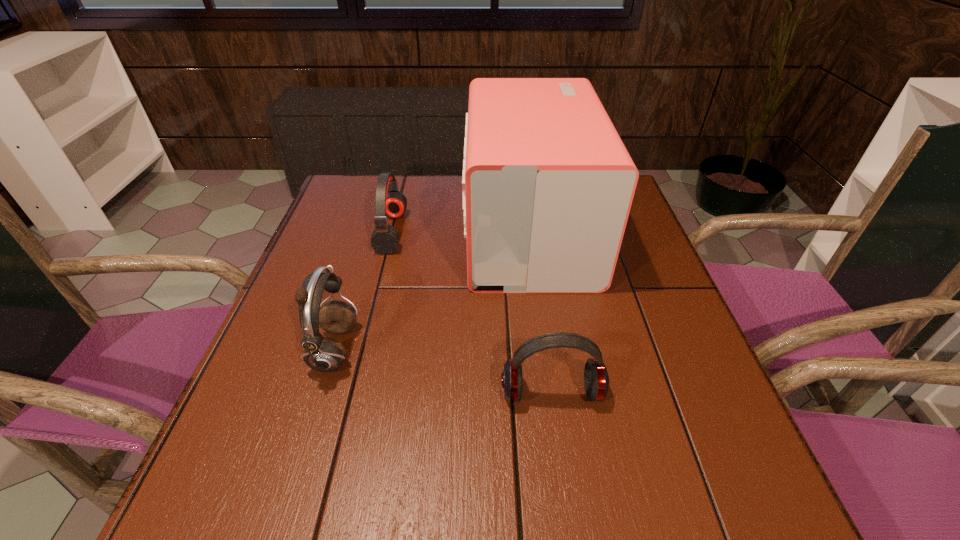
Locate an element on the screen. box situated at the far edge is located at coordinates (548, 184).

Locate an element on the screen. Image resolution: width=960 pixels, height=540 pixels. earphone located in the far edge section of the desktop is located at coordinates (390, 202).

This screenshot has width=960, height=540. I want to click on object situated at the right edge, so point(548,184).

The width and height of the screenshot is (960, 540). Find the location of `object situated at the far left corner`. object situated at the far left corner is located at coordinates pyautogui.click(x=390, y=202).

Find the location of a particular element. This screenshot has width=960, height=540. object that is at the far right corner is located at coordinates (548, 184).

In the image, there is a desktop. Identify the location of vacant space at the far edge. coord(443,209).

In the image, there is a desktop. Where is `vacant space at the near edge`? Image resolution: width=960 pixels, height=540 pixels. vacant space at the near edge is located at coordinates (622, 477).

The width and height of the screenshot is (960, 540). In the image, there is a desktop. What are the coordinates of `free region at the left edge` in the screenshot? It's located at (300, 281).

Find the location of a particular element. Image resolution: width=960 pixels, height=540 pixels. blank space at the right edge is located at coordinates (668, 333).

Identify the location of vacant space at the far left corner. The image size is (960, 540). (353, 176).